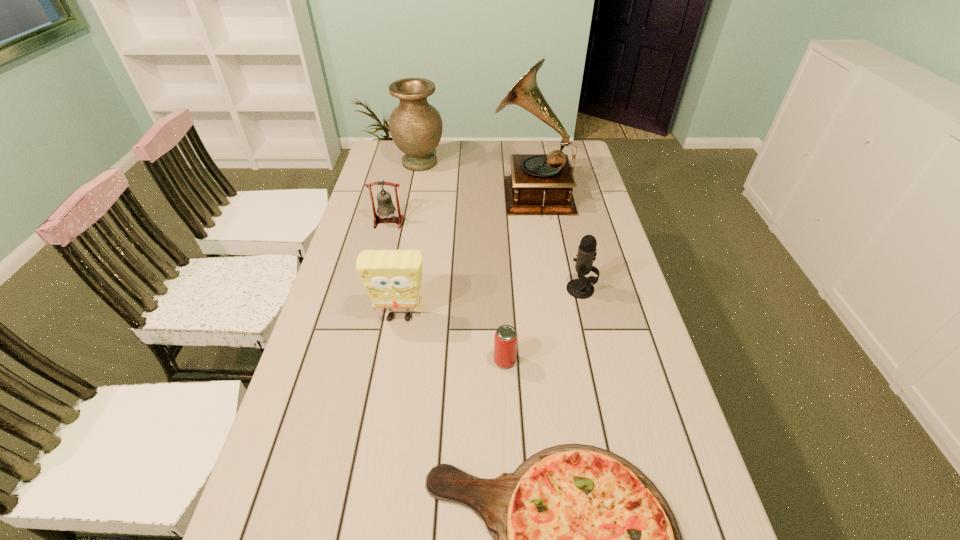
Where is `vacant space situated 0.080m on the right of the sixth shortest object`? The height and width of the screenshot is (540, 960). vacant space situated 0.080m on the right of the sixth shortest object is located at coordinates (464, 163).

The height and width of the screenshot is (540, 960). I want to click on vacant space located 0.050m on the face of the fifth farthest object, so click(x=395, y=344).

Find the location of `vacant region located 0.110m on the right of the microphone`. vacant region located 0.110m on the right of the microphone is located at coordinates (633, 289).

Where is `free space located on the front of the bell`? free space located on the front of the bell is located at coordinates (379, 260).

You are a GUI agent. You are given a task and a screenshot of the screen. Output one action in this format:
    pyautogui.click(x=<x>, y=<y>)
    Task: Click on the vacant space positioned 0.290m on the left of the second nearest object
    This screenshot has width=960, height=540.
    Given the screenshot: What is the action you would take?
    pyautogui.click(x=379, y=361)

I want to click on record player that is at the far edge, so click(539, 183).

Find the location of a particular element. The image size is (960, 540). vase present at the far edge is located at coordinates tap(416, 126).

Where is `vase positioned at the left edge`? vase positioned at the left edge is located at coordinates (416, 126).

Identify the location of sponge situated at the left edge. The image size is (960, 540). (392, 278).

At what (x,y) coordinates should I click in order to perform the action: click on bell that is positioned at the left edge. Please return your answer as a coordinate pair (x, y). This screenshot has height=540, width=960. Looking at the image, I should click on (385, 207).